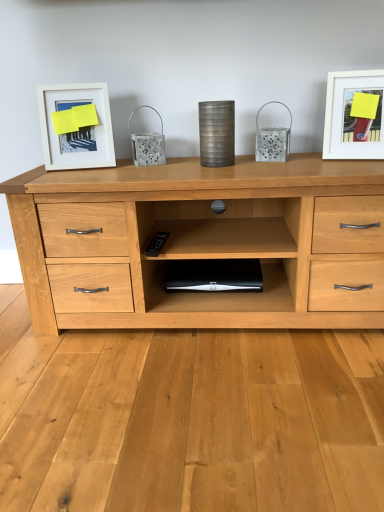
Where is `white matte picture frame at upper right, the 2th picture frame positioned from the left`? This screenshot has width=384, height=512. white matte picture frame at upper right, the 2th picture frame positioned from the left is located at coordinates (354, 115).

Locate an element on the screen. black plastic computer at center is located at coordinates (214, 275).

Describe the element at coordinates (76, 126) in the screenshot. I see `white matte picture frame at upper left, arranged as the first picture frame when viewed from the left` at that location.

Locate an element on the screen. white matte picture frame at upper right, which is the 1th picture frame in right-to-left order is located at coordinates (354, 115).

Can you confirm if white matte picture frame at upper right, the 2th picture frame positioned from the left, is smaller than white matte picture frame at upper left, acting as the 2th picture frame starting from the right?

Incorrect, white matte picture frame at upper right, the 2th picture frame positioned from the left, is not smaller in size than white matte picture frame at upper left, acting as the 2th picture frame starting from the right.

Between point (374, 147) and point (111, 136), which one is positioned behind?

Positioned behind is point (111, 136).

How many degrees apart are the facing directions of white matte picture frame at upper right, which is the 1th picture frame in right-to-left order, and white matte picture frame at upper left, arranged as the first picture frame when viewed from the left?

white matte picture frame at upper right, which is the 1th picture frame in right-to-left order, and white matte picture frame at upper left, arranged as the first picture frame when viewed from the left, are facing 26.2 degrees away from each other.

From the picture: How many degrees apart are the facing directions of black plastic computer at center and white matte picture frame at upper left, acting as the 2th picture frame starting from the right?

14.4 degrees separate the facing orientations of black plastic computer at center and white matte picture frame at upper left, acting as the 2th picture frame starting from the right.

The image size is (384, 512). I want to click on picture frame that is the 1st one when counting upward from the black plastic computer at center (from the image's perspective), so click(76, 126).

Does black plastic computer at center have a greater height compared to white matte picture frame at upper left, acting as the 2th picture frame starting from the right?

In fact, black plastic computer at center may be shorter than white matte picture frame at upper left, acting as the 2th picture frame starting from the right.

From the image's perspective, which one is positioned higher, black plastic computer at center or white matte picture frame at upper left, acting as the 2th picture frame starting from the right?

white matte picture frame at upper left, acting as the 2th picture frame starting from the right, from the image's perspective.

Which point is more forward, (91, 91) or (377, 73)?

The point (377, 73) is in front.

From the image's perspective, is white matte picture frame at upper left, arranged as the first picture frame when viewed from the left, over white matte picture frame at upper right, the 2th picture frame positioned from the left?

No, from the image's perspective, white matte picture frame at upper left, arranged as the first picture frame when viewed from the left, is not over white matte picture frame at upper right, the 2th picture frame positioned from the left.

Is white matte picture frame at upper left, arranged as the first picture frame when viewed from the left, to the left of white matte picture frame at upper right, the 2th picture frame positioned from the left, from the viewer's perspective?

Yes, white matte picture frame at upper left, arranged as the first picture frame when viewed from the left, is to the left of white matte picture frame at upper right, the 2th picture frame positioned from the left.

Can you tell me how much white matte picture frame at upper left, arranged as the first picture frame when viewed from the left, and white matte picture frame at upper right, which is the 1th picture frame in right-to-left order, differ in facing direction?

The angular difference between white matte picture frame at upper left, arranged as the first picture frame when viewed from the left, and white matte picture frame at upper right, which is the 1th picture frame in right-to-left order, is 26.2 degrees.

Could you tell me if white matte picture frame at upper left, acting as the 2th picture frame starting from the right, is turned towards black plastic computer at center?

No, white matte picture frame at upper left, acting as the 2th picture frame starting from the right, is not facing towards black plastic computer at center.

From the image's perspective, is white matte picture frame at upper left, acting as the 2th picture frame starting from the right, under black plastic computer at center?

Actually, white matte picture frame at upper left, acting as the 2th picture frame starting from the right, appears above black plastic computer at center in the image.

From a real-world perspective, which object stands above the other?

white matte picture frame at upper left, arranged as the first picture frame when viewed from the left, is physically above.

From a real-world perspective, is white matte picture frame at upper right, which is the 1th picture frame in right-to-left order, positioned under black plastic computer at center based on gravity?

Incorrect, from a real-world perspective, white matte picture frame at upper right, which is the 1th picture frame in right-to-left order, is higher than black plastic computer at center.

Can you see white matte picture frame at upper right, which is the 1th picture frame in right-to-left order, touching black plastic computer at center?

No, white matte picture frame at upper right, which is the 1th picture frame in right-to-left order, is not making contact with black plastic computer at center.

Considering the relative sizes of white matte picture frame at upper right, the 2th picture frame positioned from the left, and black plastic computer at center in the image provided, is white matte picture frame at upper right, the 2th picture frame positioned from the left, wider than black plastic computer at center?

Incorrect, the width of white matte picture frame at upper right, the 2th picture frame positioned from the left, does not surpass that of black plastic computer at center.

Does black plastic computer at center appear on the left side of white matte picture frame at upper right, which is the 1th picture frame in right-to-left order?

Yes, black plastic computer at center is to the left of white matte picture frame at upper right, which is the 1th picture frame in right-to-left order.

Locate an element on the screen. picture frame on the right of black plastic computer at center is located at coordinates tap(354, 115).

Is point (175, 277) farther from viewer compared to point (333, 128)?

Yes, point (175, 277) is farther from viewer.

Which of these two, black plastic computer at center or white matte picture frame at upper right, which is the 1th picture frame in right-to-left order, is thinner?

Thinner between the two is white matte picture frame at upper right, which is the 1th picture frame in right-to-left order.

Image resolution: width=384 pixels, height=512 pixels. I want to click on picture frame above the white matte picture frame at upper left, acting as the 2th picture frame starting from the right (from the image's perspective), so click(354, 115).

The width and height of the screenshot is (384, 512). I want to click on picture frame that is on the left side of black plastic computer at center, so click(76, 126).

From the image, which object appears to be nearer to white matte picture frame at upper left, arranged as the first picture frame when viewed from the left, white matte picture frame at upper right, the 2th picture frame positioned from the left, or black plastic computer at center?

black plastic computer at center is closer to white matte picture frame at upper left, arranged as the first picture frame when viewed from the left.

From the image, which object appears to be nearer to white matte picture frame at upper right, which is the 1th picture frame in right-to-left order, white matte picture frame at upper left, arranged as the first picture frame when viewed from the left, or black plastic computer at center?

black plastic computer at center.

Which object lies nearer to the anchor point white matte picture frame at upper left, acting as the 2th picture frame starting from the right, black plastic computer at center or white matte picture frame at upper right, which is the 1th picture frame in right-to-left order?

Among the two, black plastic computer at center is located nearer to white matte picture frame at upper left, acting as the 2th picture frame starting from the right.

Looking at the image, which one is located closer to black plastic computer at center, white matte picture frame at upper right, the 2th picture frame positioned from the left, or white matte picture frame at upper left, arranged as the first picture frame when viewed from the left?

The object closer to black plastic computer at center is white matte picture frame at upper left, arranged as the first picture frame when viewed from the left.

Estimate the real-world distances between objects in this image. Which object is further from black plastic computer at center, white matte picture frame at upper left, acting as the 2th picture frame starting from the right, or white matte picture frame at upper right, the 2th picture frame positioned from the left?

→ white matte picture frame at upper right, the 2th picture frame positioned from the left, is further to black plastic computer at center.

Looking at the image, which one is located further to white matte picture frame at upper right, which is the 1th picture frame in right-to-left order, black plastic computer at center or white matte picture frame at upper left, arranged as the first picture frame when viewed from the left?

white matte picture frame at upper left, arranged as the first picture frame when viewed from the left, is positioned further to the anchor white matte picture frame at upper right, which is the 1th picture frame in right-to-left order.

Locate an element on the screen. Image resolution: width=384 pixels, height=512 pixels. computer between white matte picture frame at upper left, acting as the 2th picture frame starting from the right, and white matte picture frame at upper right, the 2th picture frame positioned from the left, from left to right is located at coordinates (214, 275).